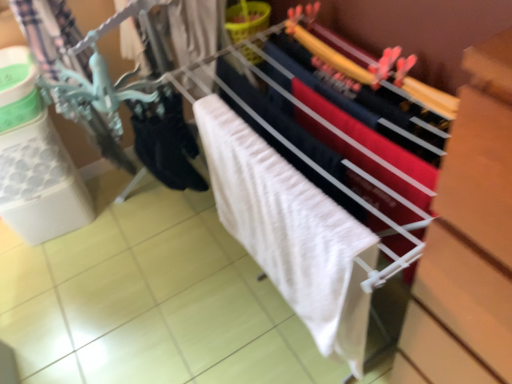
Question: Is white fabric at center spatially inside white textured bath towel at center, or outside of it?

Choices:
 (A) outside
 (B) inside

Answer: (A)

Question: Is white fabric at center to the left or to the right of white textured bath towel at center in the image?

Choices:
 (A) right
 (B) left

Answer: (A)

Question: Estimate the real-world distances between objects in this image. Which object is farther from the white fabric at center?

Choices:
 (A) black matte socks at lower left
 (B) white textured bath towel at center

Answer: (A)

Question: Considering the real-world distances, which object is farthest from the white fabric at center?

Choices:
 (A) black matte socks at lower left
 (B) white textured bath towel at center

Answer: (A)